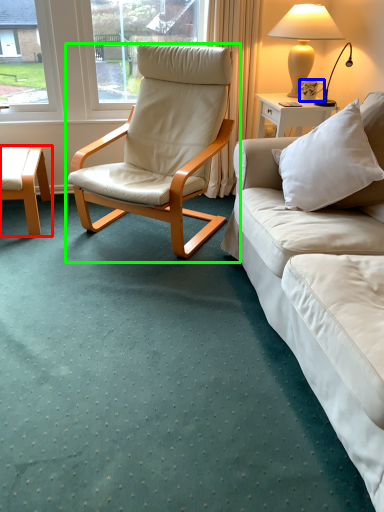
Question: Which object is the farthest from coffee table (highlighted by a red box)? Choose among these: coffee cup (highlighted by a blue box) or chair (highlighted by a green box).

Choices:
 (A) coffee cup
 (B) chair

Answer: (A)